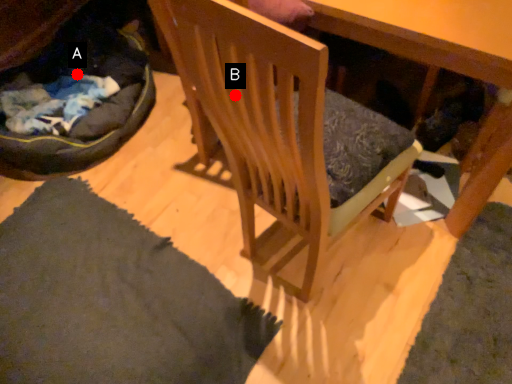
Question: Two points are circled on the image, labeled by A and B beside each circle. Which point is closer to the camera?

Choices:
 (A) A is closer
 (B) B is closer

Answer: (B)